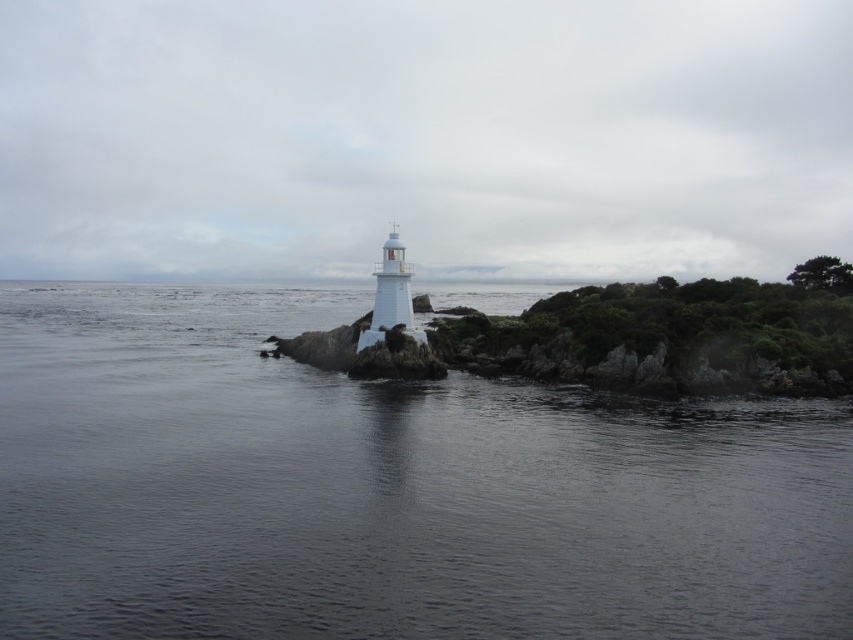
Question: Which point is farther to the camera?

Choices:
 (A) pos(247,493)
 (B) pos(378,330)

Answer: (B)

Question: Among these points, which one is farthest from the camera?

Choices:
 (A) (204, 493)
 (B) (383, 291)

Answer: (B)

Question: Is transparent water at center further to the viewer compared to white glossy lighthouse at center?

Choices:
 (A) no
 (B) yes

Answer: (A)

Question: Which object is farther from the camera taking this photo?

Choices:
 (A) transparent water at center
 (B) white glossy lighthouse at center

Answer: (B)

Question: Does transparent water at center appear over white glossy lighthouse at center?

Choices:
 (A) no
 (B) yes

Answer: (A)

Question: Can you confirm if transparent water at center is wider than white glossy lighthouse at center?

Choices:
 (A) no
 (B) yes

Answer: (B)